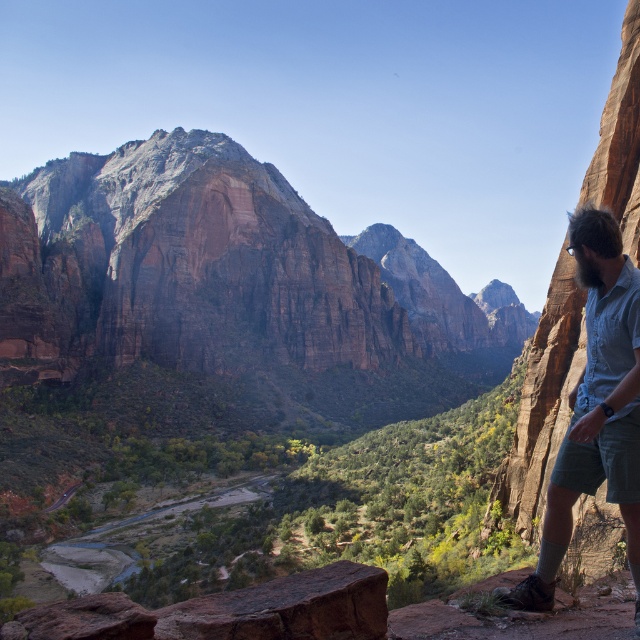
You are an adventurer standing at the edge of the rugged, reddish brown rock face in the foreground of the canyon. You see the rustic stone mountain at center and the beige textured shirt at right. Which object is bigger in size?

The rustic stone mountain at center is larger in size compared to the beige textured shirt at right.

Looking at this image, you are standing at the edge of the cliff in the mountainous landscape and notice a beige textured shirt at right. If you want to pick it up, which direction should you move towards?

The beige textured shirt at right is located at point 0.637 on the x axis and 0.931 on the y axis, so you should move towards the right and slightly downward to reach it.